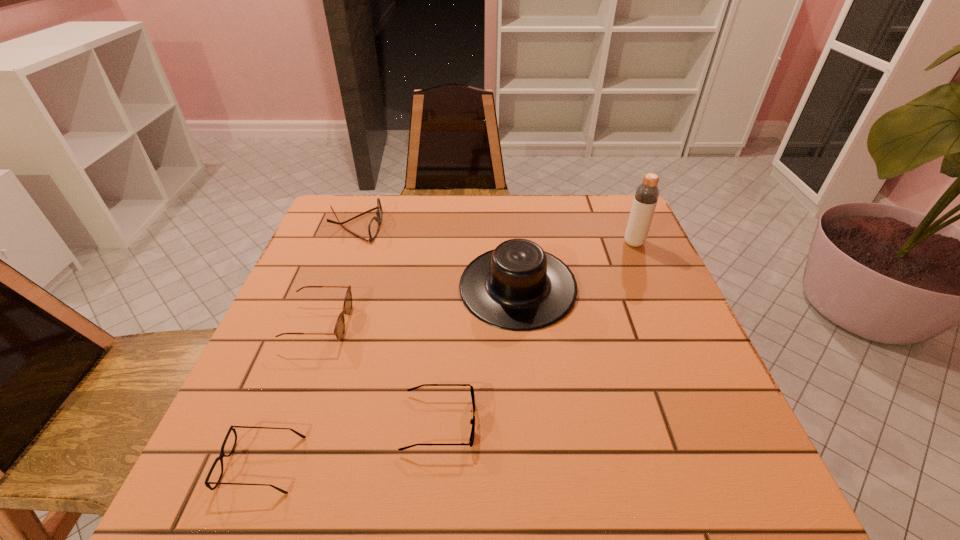
The height and width of the screenshot is (540, 960). Identify the location of bottle. (646, 196).

Where is `the rightmost object`? the rightmost object is located at coordinates (646, 196).

The width and height of the screenshot is (960, 540). I want to click on dress hat, so click(517, 286).

Locate an element on the screen. The image size is (960, 540). the second farthest spectacles is located at coordinates (339, 330).

You are a GUI agent. You are given a task and a screenshot of the screen. Output one action in this format:
    pyautogui.click(x=<x>, y=<y>)
    Task: Click on the farthest spectacles
    Image resolution: width=960 pixels, height=540 pixels.
    Given the screenshot: What is the action you would take?
    pyautogui.click(x=374, y=225)

This screenshot has width=960, height=540. Find the location of `the rightmost spectacles`. the rightmost spectacles is located at coordinates (472, 421).

You are a GUI agent. You are given a task and a screenshot of the screen. Output one action in this format:
    pyautogui.click(x=<x>, y=<y>)
    Task: Click on the free location located on the back of the rightmost object
    This screenshot has height=540, width=960.
    Given the screenshot: What is the action you would take?
    pyautogui.click(x=617, y=204)

I want to click on vacant region located 0.180m on the left of the second tallest object, so click(385, 288).

Where is `free space located 0.190m at the front view of the second farthest spectacles`? free space located 0.190m at the front view of the second farthest spectacles is located at coordinates [433, 323].

Find the location of a particular element. The height and width of the screenshot is (540, 960). free space located on the front-facing side of the farthest spectacles is located at coordinates (507, 225).